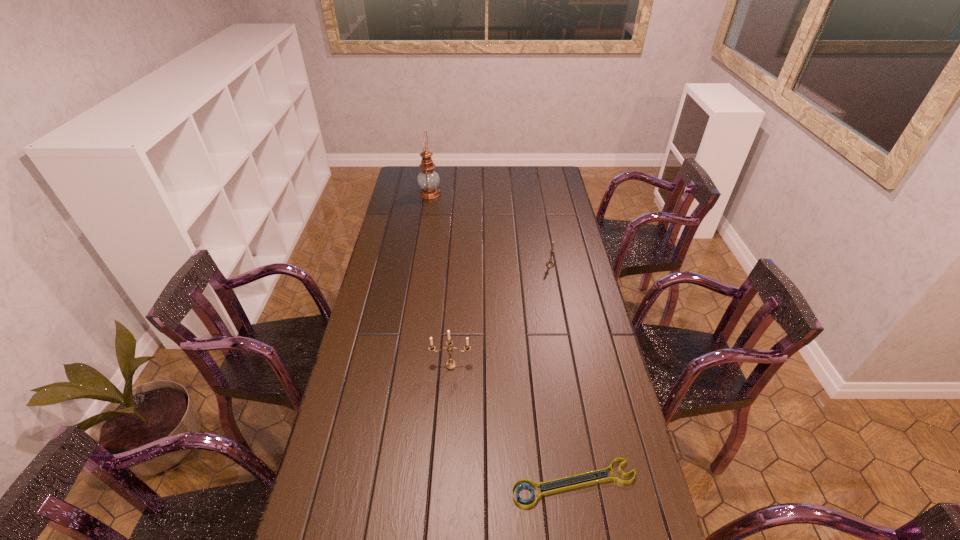
Locate an element on the screen. This screenshot has height=540, width=960. blank space at the far left corner is located at coordinates (417, 186).

In the image, there is a desktop. Find the location of `vacant space at the far right corner`. vacant space at the far right corner is located at coordinates (544, 172).

Where is `vacant space that's between the third tallest object and the second nearest object`? vacant space that's between the third tallest object and the second nearest object is located at coordinates (500, 315).

Identify the location of vacant space in between the tallest object and the nearest object. (502, 339).

Locate an element on the screen. vacant area that lies between the tallest object and the shorter candle is located at coordinates (490, 230).

Identify the location of empty location between the farther candle and the shortest object. (563, 374).

Find the location of a particular element. This screenshot has width=960, height=540. free space that is in between the nearest object and the right candle is located at coordinates (563, 374).

You are a GUI agent. You are given a task and a screenshot of the screen. Output one action in this format:
    pyautogui.click(x=<x>, y=<y>)
    Task: Click on the empty space that is in between the second tallest object and the oil lamp
    This screenshot has height=540, width=960.
    Given the screenshot: What is the action you would take?
    pyautogui.click(x=441, y=279)

Locate an element on the screen. free space between the farther candle and the nearest object is located at coordinates (563, 374).

Locate an element on the screen. The height and width of the screenshot is (540, 960). empty space that is in between the right candle and the third object from right to left is located at coordinates point(500,315).